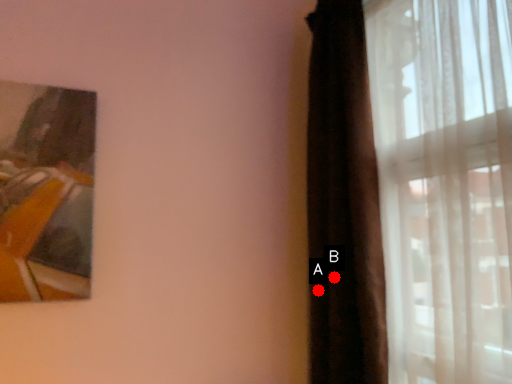
Question: Two points are circled on the image, labeled by A and B beside each circle. Which of the following is the farthest from the observer?

Choices:
 (A) A is further
 (B) B is further

Answer: (A)